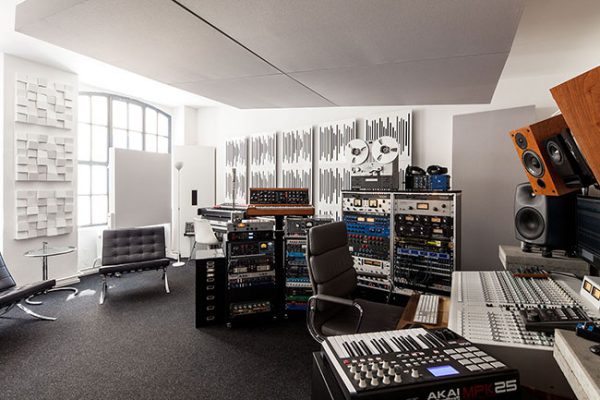
This screenshot has height=400, width=600. What are the coordinates of `grey carpet` in the screenshot? It's located at (151, 345).